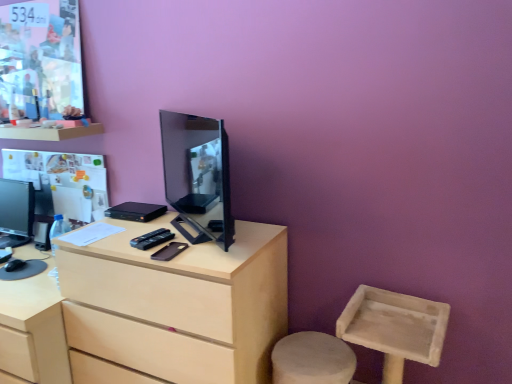
Locate an element on the screen. vacant area located to the right-hand side of black plastic remote control at center is located at coordinates (190, 236).